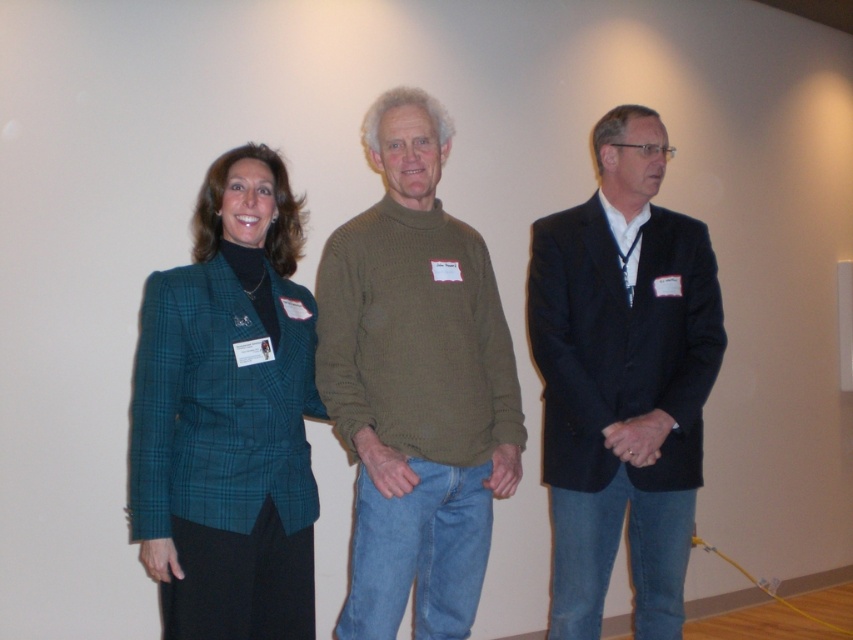
Can you confirm if knit green sweater at center is taller than teal plaid blazer at center?

Correct, knit green sweater at center is much taller as teal plaid blazer at center.

Which is more to the left, knit green sweater at center or teal plaid blazer at center?

Positioned to the left is teal plaid blazer at center.

Does point (511, 477) come closer to viewer compared to point (175, 531)?

No, (511, 477) is behind (175, 531).

I want to click on knit green sweater at center, so click(x=416, y=385).

Is teal plaid blazer at center thinner than dark blue suit at center?

Correct, teal plaid blazer at center's width is less than dark blue suit at center's.

Does teal plaid blazer at center appear under dark blue suit at center?

Incorrect, teal plaid blazer at center is not positioned below dark blue suit at center.

The image size is (853, 640). What do you see at coordinates (228, 416) in the screenshot? I see `teal plaid blazer at center` at bounding box center [228, 416].

You are a GUI agent. You are given a task and a screenshot of the screen. Output one action in this format:
    pyautogui.click(x=<x>, y=<y>)
    Task: Click on the teal plaid blazer at center
    Image resolution: width=853 pixels, height=640 pixels.
    Given the screenshot: What is the action you would take?
    pyautogui.click(x=228, y=416)

From the picture: Which is above, knit green sweater at center or dark blue suit at center?

Positioned higher is knit green sweater at center.

Which is behind, point (466, 458) or point (639, 353)?

The point (639, 353) is behind.

Locate an element on the screen. knit green sweater at center is located at coordinates (416, 385).